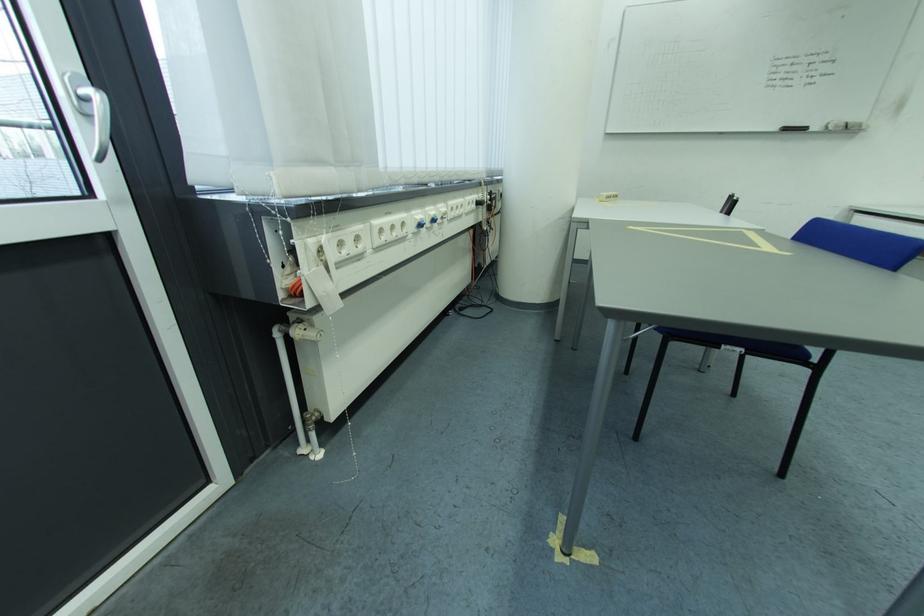
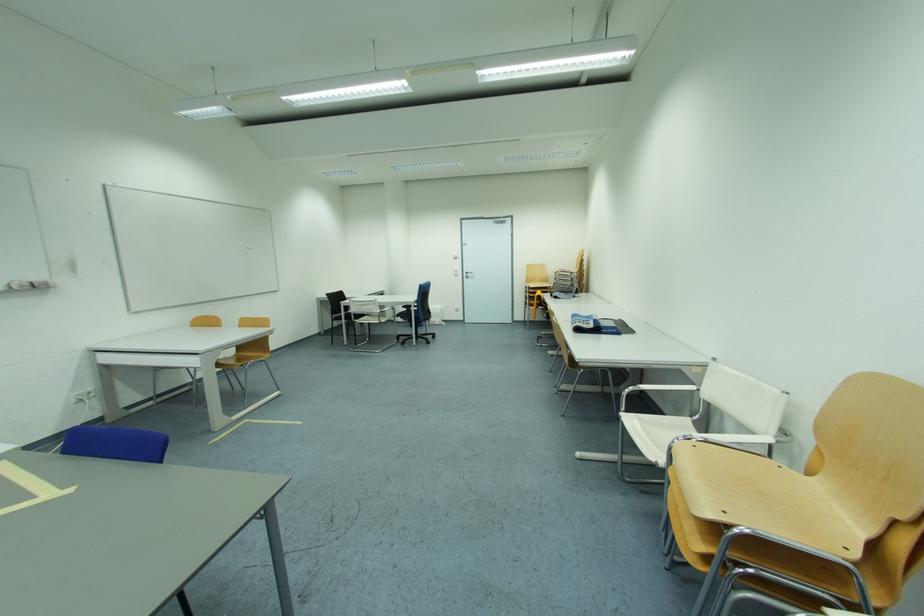
Question: The images are taken continuously from a first-person perspective. In which direction is your viewpoint rotating?

Choices:
 (A) Left
 (B) Right
 (C) Up
 (D) Down

Answer: (B)